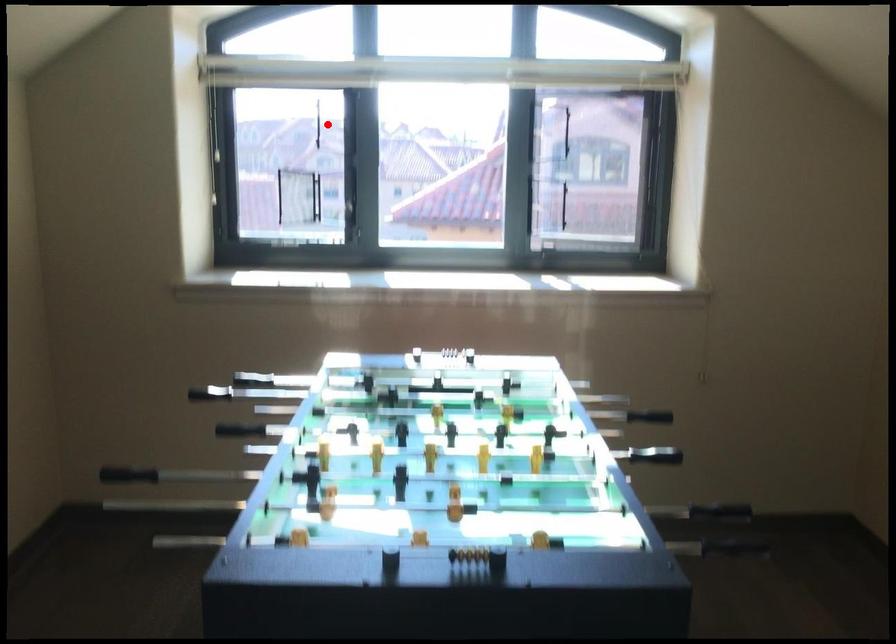
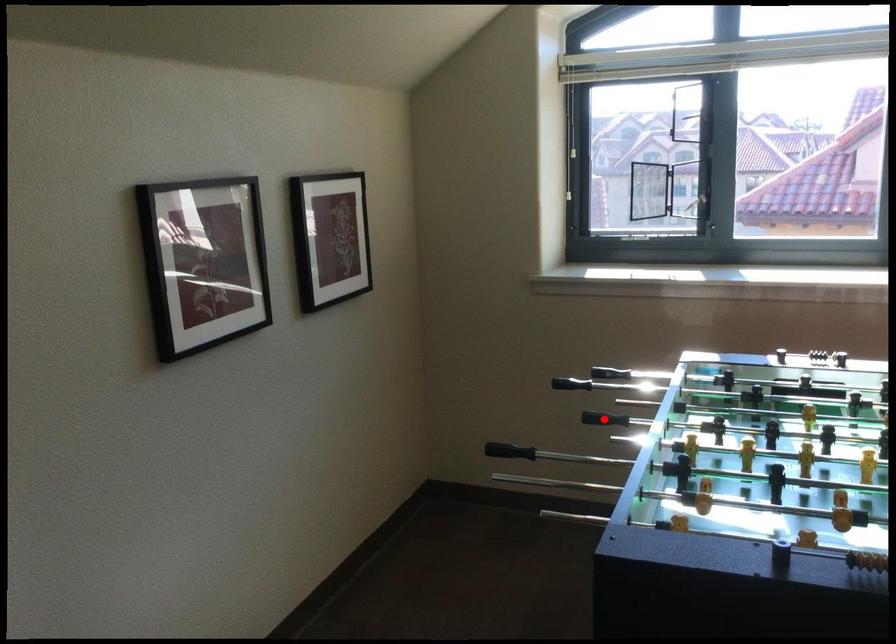
I am providing you with two images of the same scene from different viewpoints. A red point is marked on the first image and another point is marked on the second image. Is the marked point in image1 the same physical position as the marked point in image2?

No